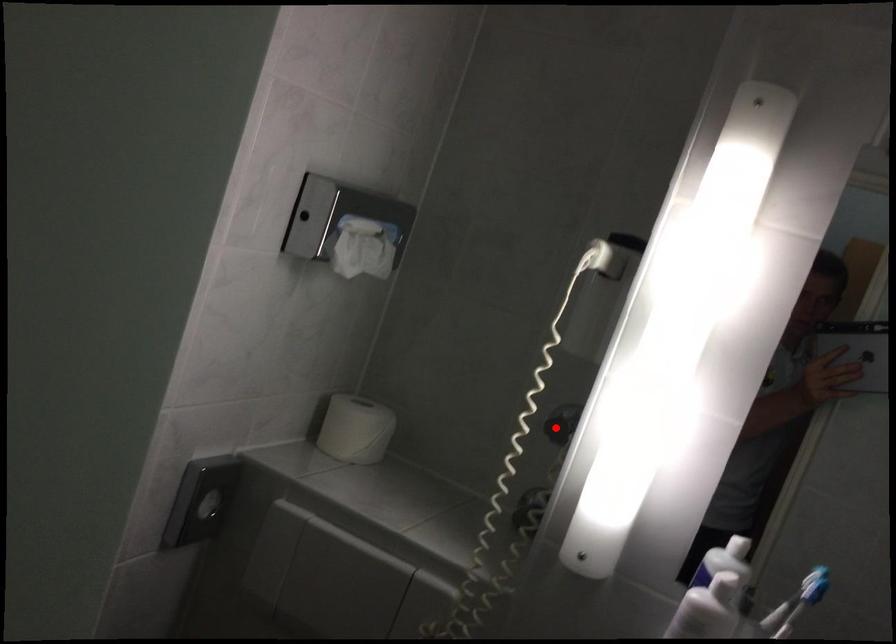
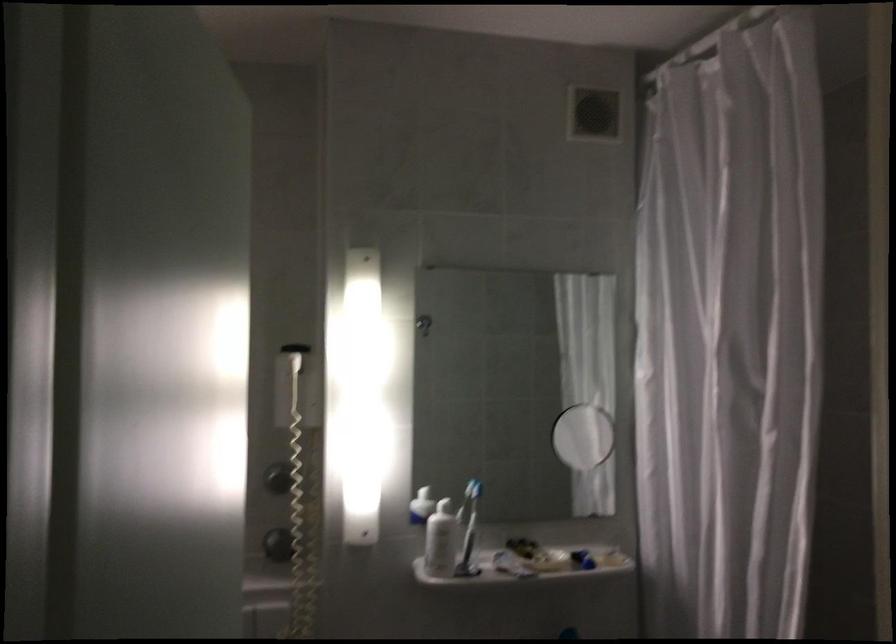
Find the pixel in the second image that matches the highlighted location in the first image.

(278, 478)